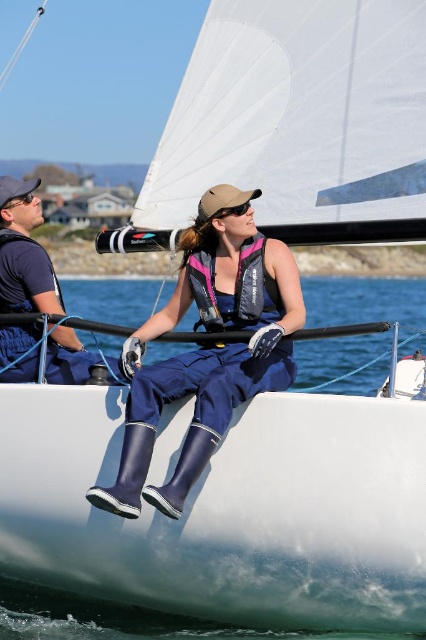
You are a photographer on the sailboat and want to take a photo of the navy rubber boots at center and the matte black camera at left. Which object is closer to you, the photographer, when you are positioned at the back of the boat?

The navy rubber boots at center is closer to you than the matte black camera at left because it is further to the viewer.

You are a sailor on the boat and you need to place a small navigation tool at the point with coordinates point [207,348]. Where exactly should you place it?

The point [207,348] is on navy rubber boots at center, so you should place the navigation tool on the navy rubber boots at center.

You are a photographer on the sailboat and need to take a photo of the woman in the navy blue jumpsuit. Your matte black camera at left is on the deck. Where should you position yourself to ensure the navy rubber boots at center are not blocking the view of the woman?

You should position yourself to the left of the matte black camera at left so that the navy rubber boots at center, which are to the right of the matte black camera at left, do not block the view of the woman.